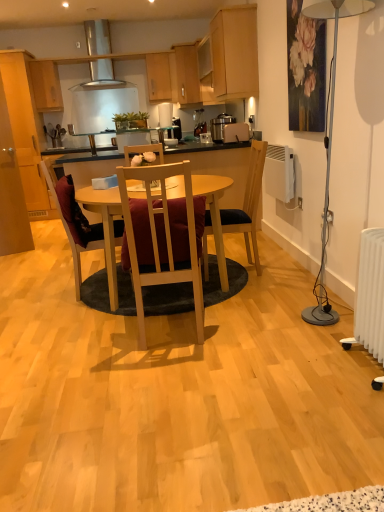
Image resolution: width=384 pixels, height=512 pixels. What do you see at coordinates (228, 129) in the screenshot? I see `metallic silver toaster at upper center` at bounding box center [228, 129].

What do you see at coordinates (235, 53) in the screenshot?
I see `light wood cabinet at upper center, the fifth cabinetry positioned from the left` at bounding box center [235, 53].

Locate an element on the screen. The image size is (384, 512). silver metallic floor lamp at right is located at coordinates (329, 140).

Describe the element at coordinates (187, 73) in the screenshot. I see `wooden cabinet at upper center, which appears as the 4th cabinetry when viewed from the left` at that location.

Find the location of a particular element. wooden cabinet at upper center, the second cabinetry viewed from the right is located at coordinates (187, 73).

At what (x,y) coordinates should I click in order to perform the action: click on metallic silver toaster at upper center. Please return your answer as a coordinate pair (x, y). The image size is (384, 512). Looking at the image, I should click on (228, 129).

Who is taller, light wood table at center or velvet maroon chair at center, the 1th chair positioned from the left?

With more height is velvet maroon chair at center, the 1th chair positioned from the left.

From the image's perspective, is light wood table at center located above or below velvet maroon chair at center, the 1th chair positioned from the left?

light wood table at center is below velvet maroon chair at center, the 1th chair positioned from the left.

From a real-world perspective, who is located higher, light wood table at center or velvet maroon chair at center, the 1th chair positioned from the left?

velvet maroon chair at center, the 1th chair positioned from the left.

Is velvet maroon chair at center, which is the 3th chair in right-to-left order, located within light wood table at center?

Yes, velvet maroon chair at center, which is the 3th chair in right-to-left order, is surrounded by light wood table at center.

From the picture: Who is more distant, metallic silver toaster at upper center or velvet maroon chair at center, which is the 3th chair in right-to-left order?

Positioned behind is metallic silver toaster at upper center.

How many degrees apart are the facing directions of metallic silver toaster at upper center and velvet maroon chair at center, which is the 3th chair in right-to-left order?

The angle between the facing direction of metallic silver toaster at upper center and the facing direction of velvet maroon chair at center, which is the 3th chair in right-to-left order, is 150 degrees.

From the image's perspective, relative to velvet maroon chair at center, which is the 3th chair in right-to-left order, is metallic silver toaster at upper center above or below?

From the image's perspective, metallic silver toaster at upper center appears above velvet maroon chair at center, which is the 3th chair in right-to-left order.

Considering the sizes of objects metallic silver toaster at upper center and velvet maroon chair at center, which is the 3th chair in right-to-left order, in the image provided, who is thinner, metallic silver toaster at upper center or velvet maroon chair at center, which is the 3th chair in right-to-left order,?

Thinner between the two is metallic silver toaster at upper center.

Considering the relative sizes of velvet maroon chair at center, the 1th chair positioned from the left, and satin silver exhaust hood at upper center in the image provided, is velvet maroon chair at center, the 1th chair positioned from the left, bigger than satin silver exhaust hood at upper center?

Yes.

Is point (43, 163) behind point (102, 88)?

That is False.

In terms of width, does velvet maroon chair at center, which is the 3th chair in right-to-left order, look wider or thinner when compared to satin silver exhaust hood at upper center?

velvet maroon chair at center, which is the 3th chair in right-to-left order, is wider than satin silver exhaust hood at upper center.

Is velvet maroon chair at center, the 1th chair positioned from the left, not within satin silver exhaust hood at upper center?

velvet maroon chair at center, the 1th chair positioned from the left, is positioned outside satin silver exhaust hood at upper center.

Considering the sizes of objects velvet maroon chair at center, which is the 3th chair in right-to-left order, and white plastic radiator at lower right in the image provided, who is thinner, velvet maroon chair at center, which is the 3th chair in right-to-left order, or white plastic radiator at lower right?

white plastic radiator at lower right.

Is velvet maroon chair at center, the 1th chair positioned from the left, oriented towards white plastic radiator at lower right?

No, velvet maroon chair at center, the 1th chair positioned from the left, is not oriented towards white plastic radiator at lower right.

Would you say velvet maroon chair at center, the 1th chair positioned from the left, is outside white plastic radiator at lower right?

Yes, velvet maroon chair at center, the 1th chair positioned from the left, is located beyond the bounds of white plastic radiator at lower right.

In the image, there is a velvet maroon chair at center, which is the 3th chair in right-to-left order. Identify the location of radiator below it (from a real-world perspective). The width and height of the screenshot is (384, 512). (370, 294).

From a real-world perspective, which object rests below the other?

From a 3D spatial view, wooden chair at center, the 2th chair in the left-to-right sequence, is below.

Looking at this image, could wooden chair at center, the 2th chair in the left-to-right sequence, be considered to be inside silver metallic floor lamp at right?

That's incorrect, wooden chair at center, the 2th chair in the left-to-right sequence, is not inside silver metallic floor lamp at right.

Which object is positioned more to the right, silver metallic floor lamp at right or wooden chair at center, the 2th chair in the left-to-right sequence?

From the viewer's perspective, silver metallic floor lamp at right appears more on the right side.

Is the depth of silver metallic floor lamp at right greater than that of wooden chair at center, which appears as the 2th chair when viewed from the right?

No, the depth of silver metallic floor lamp at right is less than that of wooden chair at center, which appears as the 2th chair when viewed from the right.

Where is `the 3rd cabinetry to the left of the white plastic radiator at lower right, counting from the anchor's position`? The width and height of the screenshot is (384, 512). the 3rd cabinetry to the left of the white plastic radiator at lower right, counting from the anchor's position is located at coordinates (161, 77).

Is white plastic radiator at lower right surrounding wooden cabinet at upper center, which ranks as the 3th cabinetry in left-to-right order?

No, wooden cabinet at upper center, which ranks as the 3th cabinetry in left-to-right order, is not inside white plastic radiator at lower right.

Is white plastic radiator at lower right not close to wooden cabinet at upper center, which ranks as the 3th cabinetry in left-to-right order?

Yes, white plastic radiator at lower right is far from wooden cabinet at upper center, which ranks as the 3th cabinetry in left-to-right order.

Is velvet maroon chair at center, which is the 3th chair in right-to-left order, in contact with silver metallic floor lamp at right?

No, velvet maroon chair at center, which is the 3th chair in right-to-left order, is not beside silver metallic floor lamp at right.

Considering the sizes of velvet maroon chair at center, the 1th chair positioned from the left, and silver metallic floor lamp at right in the image, is velvet maroon chair at center, the 1th chair positioned from the left, taller or shorter than silver metallic floor lamp at right?

Clearly, velvet maroon chair at center, the 1th chair positioned from the left, is shorter compared to silver metallic floor lamp at right.

Considering the positions of objects velvet maroon chair at center, which is the 3th chair in right-to-left order, and silver metallic floor lamp at right in the image provided, who is more to the left, velvet maroon chair at center, which is the 3th chair in right-to-left order, or silver metallic floor lamp at right?

velvet maroon chair at center, which is the 3th chair in right-to-left order.

Is velvet maroon chair at center, which is the 3th chair in right-to-left order, looking in the opposite direction of silver metallic floor lamp at right?

No.

Locate an element on the screen. desk located below the velvet maroon chair at center, the 1th chair positioned from the left (from the image's perspective) is located at coordinates (105, 228).

I want to click on appliance located on the right of velvet maroon chair at center, the 1th chair positioned from the left, so click(228, 129).

From the image, which object appears to be nearer to light wood table at center, wooden cabinet at upper center, which is the 3th cabinetry from right to left, or wooden chair at center, acting as the 1th chair starting from the right?

wooden chair at center, acting as the 1th chair starting from the right, lies closer to light wood table at center than the other object.

When comparing their distances from light wood table at center, does wooden cabinet at upper center, which ranks as the 3th cabinetry in left-to-right order, or matte wood cabinets at upper left, acting as the 1th cabinetry starting from the left, seem further?

Based on the image, wooden cabinet at upper center, which ranks as the 3th cabinetry in left-to-right order, appears to be further to light wood table at center.

Considering their positions, is velvet maroon chair at center, the 1th chair positioned from the left, positioned further to wooden chair at center, the 2th chair in the left-to-right sequence, than matte wood cabinets at upper left, the 5th cabinetry in the right-to-left sequence?

matte wood cabinets at upper left, the 5th cabinetry in the right-to-left sequence, lies further to wooden chair at center, the 2th chair in the left-to-right sequence, than the other object.

Based on their spatial positions, is satin silver exhaust hood at upper center or metallic silver toaster at upper center closer to wooden chair at center, the 2th chair in the left-to-right sequence?

The object closer to wooden chair at center, the 2th chair in the left-to-right sequence, is metallic silver toaster at upper center.

From the image, which object appears to be nearer to wooden cabinet at upper center, which is the 3th cabinetry from right to left, wooden chair at center, acting as the 1th chair starting from the right, or silver metallic floor lamp at right?

Based on the image, wooden chair at center, acting as the 1th chair starting from the right, appears to be nearer to wooden cabinet at upper center, which is the 3th cabinetry from right to left.

Based on their spatial positions, is wooden cabinet at upper center, which ranks as the 3th cabinetry in left-to-right order, or wooden cabinet at upper center, which appears as the 4th cabinetry when viewed from the left, further from silver metallic floor lamp at right?

wooden cabinet at upper center, which ranks as the 3th cabinetry in left-to-right order, is positioned further to the anchor silver metallic floor lamp at right.

Based on their spatial positions, is matte wood cabinets at upper left, the 5th cabinetry in the right-to-left sequence, or satin silver exhaust hood at upper center further from velvet maroon chair at center, which is the 3th chair in right-to-left order?

satin silver exhaust hood at upper center is further to velvet maroon chair at center, which is the 3th chair in right-to-left order.

Considering their positions, is wooden cabinet at upper center, the second cabinetry viewed from the right, positioned further to wooden cabinet at upper center, which is the 3th cabinetry from right to left, than silver metallic floor lamp at right?

silver metallic floor lamp at right is further to wooden cabinet at upper center, which is the 3th cabinetry from right to left.

In order to click on desk between white plastic radiator at lower right and matte wood cabinets at upper left, acting as the 1th cabinetry starting from the left, from front to back in this screenshot , I will do `click(105, 228)`.

Where is `appliance situated between matte wood cabinet at upper left, which is the second cabinetry from left to right, and light wood cabinet at upper center, acting as the 1th cabinetry starting from the right, from left to right`? This screenshot has height=512, width=384. appliance situated between matte wood cabinet at upper left, which is the second cabinetry from left to right, and light wood cabinet at upper center, acting as the 1th cabinetry starting from the right, from left to right is located at coordinates (x=228, y=129).

Find the location of a particular element. The height and width of the screenshot is (512, 384). appliance located between wooden chair at center, acting as the 1th chair starting from the right, and satin silver exhaust hood at upper center in the depth direction is located at coordinates tap(228, 129).

Locate an element on the screen. Image resolution: width=384 pixels, height=512 pixels. desk between silver metallic floor lamp at right and matte wood cabinets at upper left, the 5th cabinetry in the right-to-left sequence, from front to back is located at coordinates (105, 228).